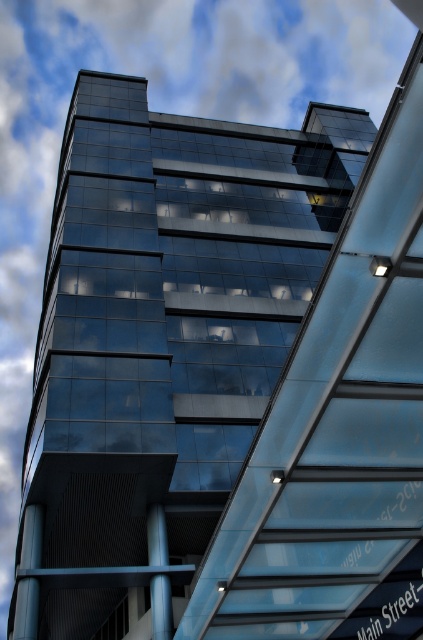
Question: Is metallic gray pillar at lower left smaller than metallic blue pole at center?

Choices:
 (A) no
 (B) yes

Answer: (A)

Question: Which object is closer to the camera taking this photo?

Choices:
 (A) metallic gray pillar at lower left
 (B) metallic blue pole at center

Answer: (A)

Question: Is metallic gray pillar at lower left below metallic blue pole at center?

Choices:
 (A) no
 (B) yes

Answer: (A)

Question: Which point is closer to the camera?

Choices:
 (A) (156, 552)
 (B) (25, 522)

Answer: (A)

Question: Observing the image, what is the correct spatial positioning of metallic gray pillar at lower left in reference to metallic blue pole at center?

Choices:
 (A) right
 (B) left

Answer: (B)